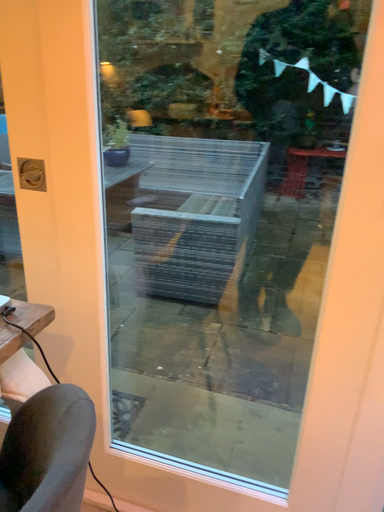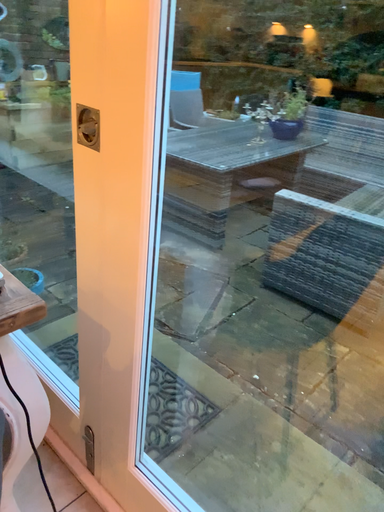
Question: Which way did the camera rotate in the video?

Choices:
 (A) rotated right
 (B) rotated left

Answer: (B)